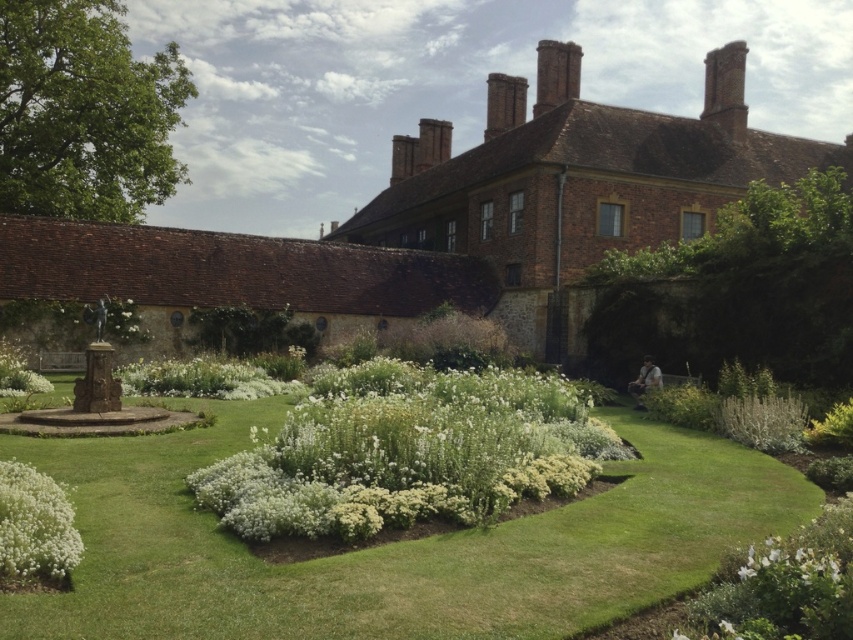
Consider the image. You are a gardener who needs to water the white matte flower at lower right using a hose that can reach up to 8 meters. You are currently standing on the green grass at center. Can you reach the flower without moving your position?

The distance between the green grass at center and the white matte flower at lower right is 7.64 meters, which is within the hose reach of 8 meters. Therefore, you can water the white matte flower at lower right without moving from the green grass at center.

You are planning to place a small garden statue that is 2 meters wide in the garden. Based on the scene, which area between the green grass at center and the white fluffy bush at lower left can accommodate the statue without overcrowding?

The green grass at center has a greater width than the white fluffy bush at lower left, so the statue can be placed on the green grass at center as it provides more space.